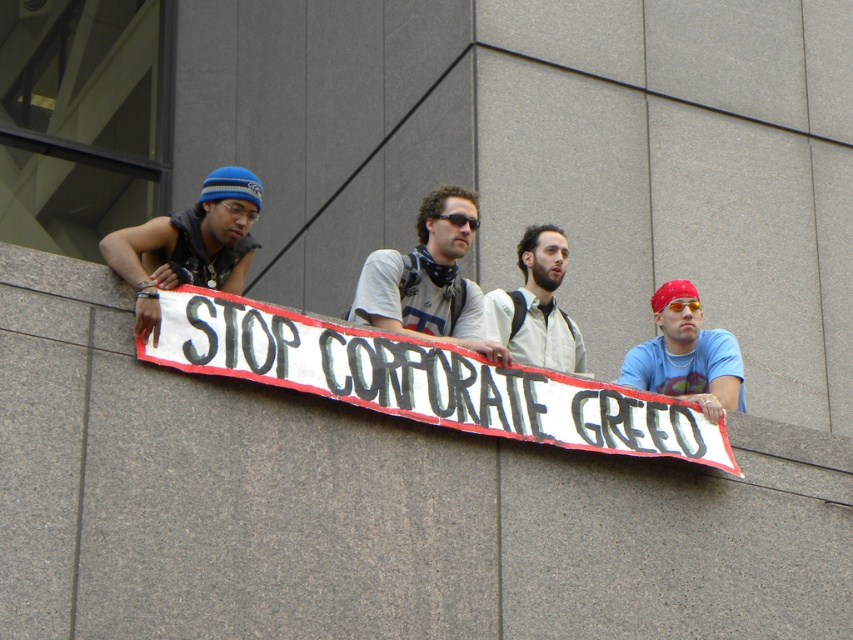
You are a safety inspector assessing the scene. The white shirt at center and orange reflective goggles at center are both in the center of the image. According to safety regulations, which object must be placed closer to the edge for visibility?

The orange reflective goggles at center must be placed closer to the edge for visibility since safety regulations require reflective gear to be positioned where it is most visible, typically near the edges of work areas to alert others of potential hazards.